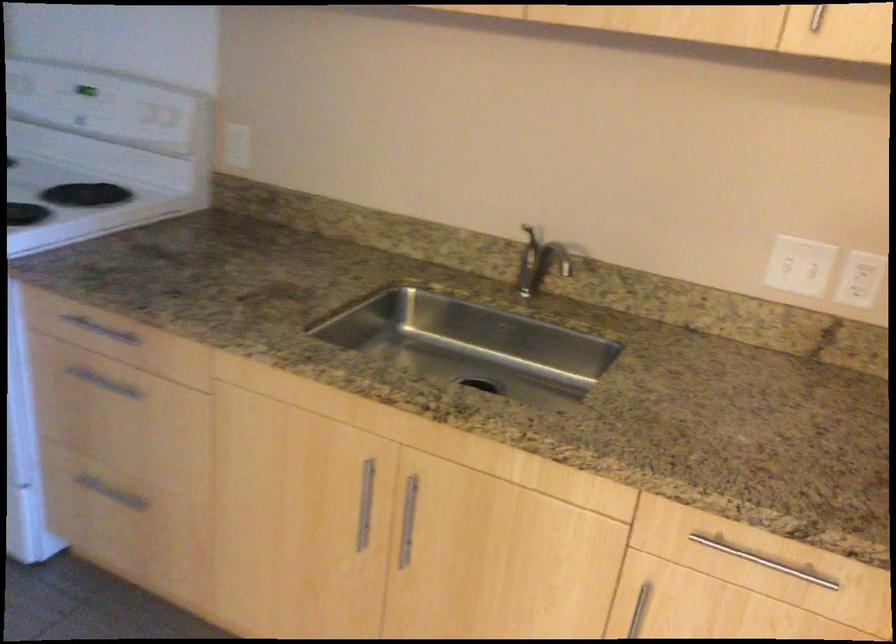
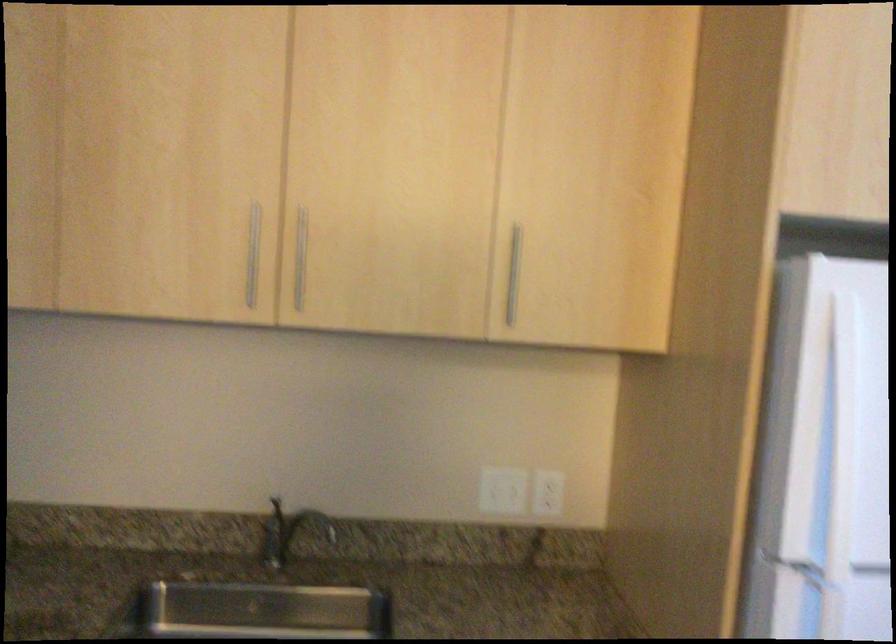
Question: The camera is either moving clockwise (left) or counter-clockwise (right) around the object. The first image is from the beginning of the video and the second image is from the end. Is the camera moving left or right when shooting the video?

Choices:
 (A) Left
 (B) Right

Answer: (A)